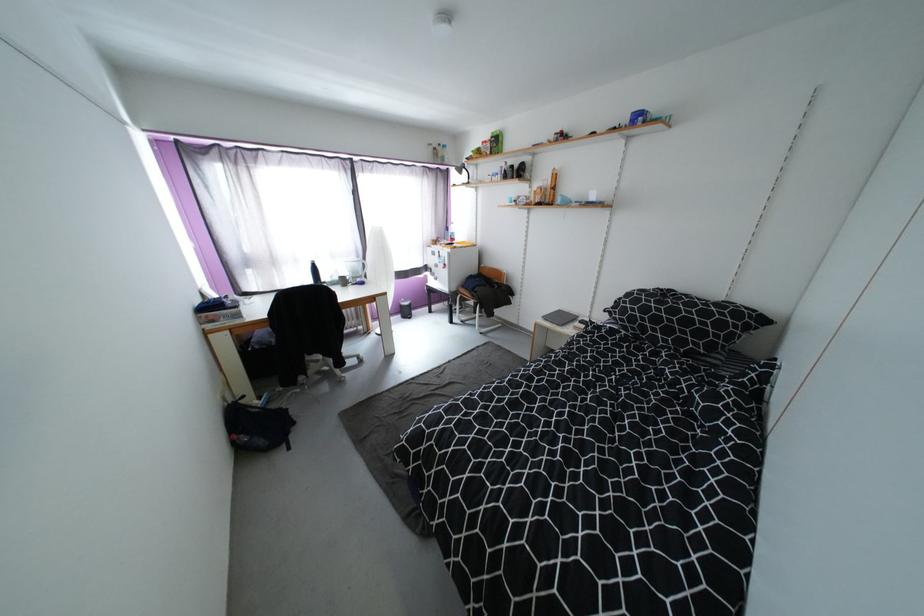
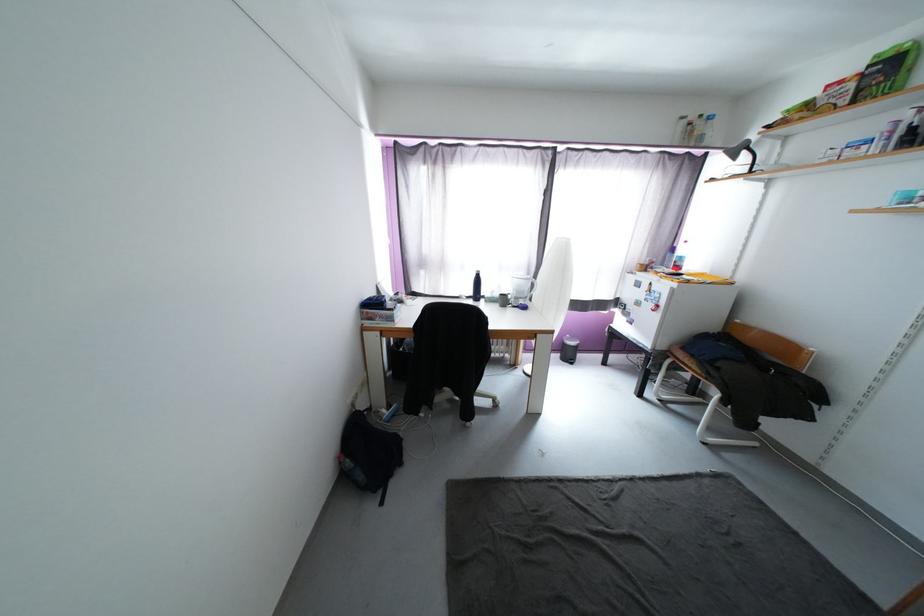
The point at (359, 280) is marked in the first image. Where is the corresponding point in the second image?

(521, 300)